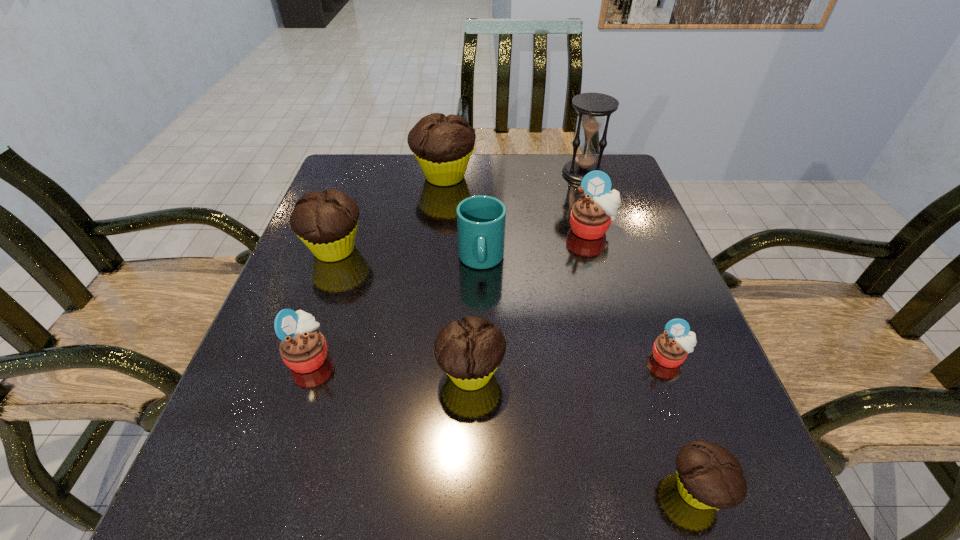
Find the location of `vacant position in the image that satisfies the following two spatial constraints: 1. on the front side of the third farthest chocolate muffin; 2. on the left side of the third smallest chocolate muffin`. vacant position in the image that satisfies the following two spatial constraints: 1. on the front side of the third farthest chocolate muffin; 2. on the left side of the third smallest chocolate muffin is located at coordinates (290, 373).

I want to click on free space that satisfies the following two spatial constraints: 1. on the front-facing side of the second biggest pink muffin; 2. on the right side of the nearest muffin, so click(x=264, y=490).